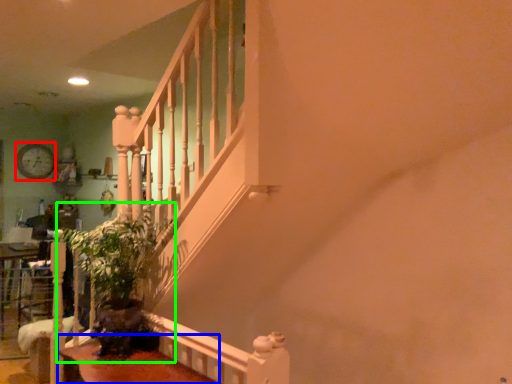
Question: Which object is the farthest from clock (highlighted by a red box)? Choose among these: table (highlighted by a blue box) or plant (highlighted by a green box).

Choices:
 (A) table
 (B) plant

Answer: (A)